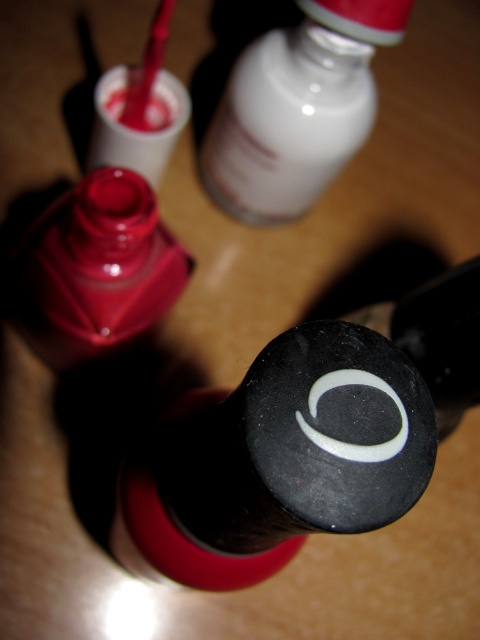
Is the position of white glossy bottle at upper center more distant than that of matte red nail polish at center?

Yes.

From the picture: Does white glossy bottle at upper center have a smaller size compared to matte red nail polish at center?

No, white glossy bottle at upper center is not smaller than matte red nail polish at center.

What do you see at coordinates (297, 108) in the screenshot?
I see `white glossy bottle at upper center` at bounding box center [297, 108].

Where is `white glossy bottle at upper center`? white glossy bottle at upper center is located at coordinates (297, 108).